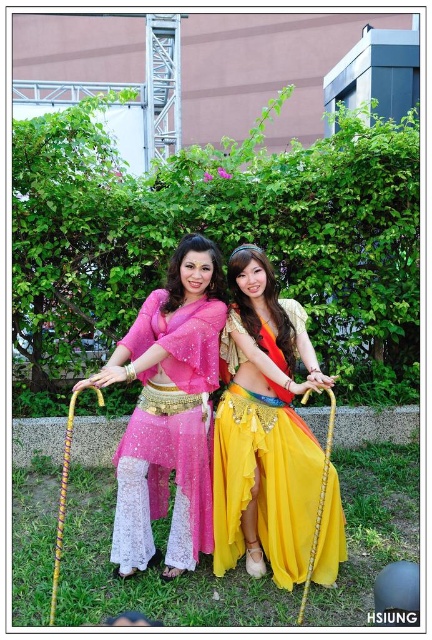
Does shiny yellow fabric skirt at center have a smaller size compared to pink lace pants at center?

Yes, shiny yellow fabric skirt at center is smaller than pink lace pants at center.

Can you confirm if shiny yellow fabric skirt at center is bigger than pink lace pants at center?

Incorrect, shiny yellow fabric skirt at center is not larger than pink lace pants at center.

Locate an element on the screen. shiny yellow fabric skirt at center is located at coordinates (263, 429).

Where is `shiny yellow fabric skirt at center`? This screenshot has width=432, height=640. shiny yellow fabric skirt at center is located at coordinates (263, 429).